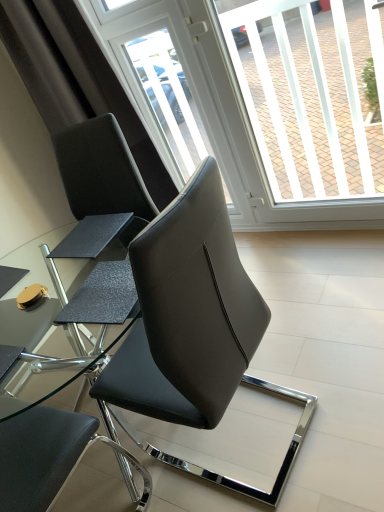
What do you see at coordinates (166, 87) in the screenshot? I see `transparent plastic screen door at upper center` at bounding box center [166, 87].

I want to click on transparent plastic screen door at upper center, so click(166, 87).

Is black leather chair at center, which is the 2th chair in front-to-back order, situated inside transparent glass window screen at upper center or outside?

black leather chair at center, which is the 2th chair in front-to-back order, is not inside transparent glass window screen at upper center, it's outside.

Could you measure the distance between black leather chair at center, the 2th chair in the back-to-front sequence, and transparent glass window screen at upper center?

black leather chair at center, the 2th chair in the back-to-front sequence, is 1.87 meters from transparent glass window screen at upper center.

Which object is further away from the camera taking this photo, black leather chair at center, the 2th chair in the back-to-front sequence, or transparent glass window screen at upper center?

transparent glass window screen at upper center is further from the camera.

From a real-world perspective, is black leather chair at center, which is the 2th chair in front-to-back order, positioned under transparent glass window screen at upper center based on gravity?

Yes, from a real-world perspective, black leather chair at center, which is the 2th chair in front-to-back order, is below transparent glass window screen at upper center.

Does transparent plastic screen door at upper center have a lesser height compared to black leather chair at center, which is the 1th chair from front to back?

No.

Considering the relative sizes of transparent plastic screen door at upper center and black leather chair at center, which is the 1th chair from front to back, in the image provided, is transparent plastic screen door at upper center thinner than black leather chair at center, which is the 1th chair from front to back,?

Indeed, transparent plastic screen door at upper center has a lesser width compared to black leather chair at center, which is the 1th chair from front to back.

Is transparent plastic screen door at upper center far away from black leather chair at center, which is the 1th chair from front to back?

Absolutely, transparent plastic screen door at upper center is distant from black leather chair at center, which is the 1th chair from front to back.

Image resolution: width=384 pixels, height=512 pixels. I want to click on screen door behind the black leather chair at center, which is the third chair in back-to-front order, so click(166, 87).

Is black leather chair at center, the 2th chair in the back-to-front sequence, far away from matte black chair at center, marked as the third chair in a front-to-back arrangement?

No, black leather chair at center, the 2th chair in the back-to-front sequence, is in close proximity to matte black chair at center, marked as the third chair in a front-to-back arrangement.

What's the angular difference between black leather chair at center, the 2th chair in the back-to-front sequence, and matte black chair at center, marked as the third chair in a front-to-back arrangement,'s facing directions?

black leather chair at center, the 2th chair in the back-to-front sequence, and matte black chair at center, marked as the third chair in a front-to-back arrangement, are facing 176 degrees away from each other.

In terms of height, does black leather chair at center, the 2th chair in the back-to-front sequence, look taller or shorter compared to matte black chair at center, marked as the third chair in a front-to-back arrangement?

black leather chair at center, the 2th chair in the back-to-front sequence, is shorter than matte black chair at center, marked as the third chair in a front-to-back arrangement.

Is black leather chair at center, the 2th chair in the back-to-front sequence, situated inside matte black chair at center, the 1th chair positioned from the back, or outside?

black leather chair at center, the 2th chair in the back-to-front sequence, exists outside the volume of matte black chair at center, the 1th chair positioned from the back.

Can you confirm if transparent plastic screen door at upper center is bigger than matte black chair at center, marked as the third chair in a front-to-back arrangement?

Actually, transparent plastic screen door at upper center might be smaller than matte black chair at center, marked as the third chair in a front-to-back arrangement.

Choose the correct answer: Is transparent plastic screen door at upper center inside matte black chair at center, marked as the third chair in a front-to-back arrangement, or outside it?

transparent plastic screen door at upper center is spatially situated outside matte black chair at center, marked as the third chair in a front-to-back arrangement.

Between transparent plastic screen door at upper center and matte black chair at center, marked as the third chair in a front-to-back arrangement, which one has more height?

transparent plastic screen door at upper center.

Considering the points (148, 67) and (113, 198), which point is in front, point (148, 67) or point (113, 198)?

Point (113, 198)

Is transparent glass window screen at upper center wider than black leather chair at center, which is the third chair in back-to-front order?

In fact, transparent glass window screen at upper center might be narrower than black leather chair at center, which is the third chair in back-to-front order.

From a real-world perspective, is transparent glass window screen at upper center on black leather chair at center, which is the 1th chair from front to back?

Yes, from a real-world perspective, transparent glass window screen at upper center is on top of black leather chair at center, which is the 1th chair from front to back.

Can we say transparent glass window screen at upper center lies outside black leather chair at center, which is the third chair in back-to-front order?

Absolutely, transparent glass window screen at upper center is external to black leather chair at center, which is the third chair in back-to-front order.

Are black leather chair at center, which is the 2th chair in front-to-back order, and transparent plastic screen door at upper center making contact?

No, black leather chair at center, which is the 2th chair in front-to-back order, is not in contact with transparent plastic screen door at upper center.

Is point (34, 460) positioned after point (164, 128)?

No, (34, 460) is closer to viewer.

From a real-world perspective, which object stands above the other?

In real-world perspective, transparent plastic screen door at upper center is above.

From the image's perspective, is black leather chair at center, which is the 2th chair in front-to-back order, above or below transparent plastic screen door at upper center?

Based on their image positions, black leather chair at center, which is the 2th chair in front-to-back order, is located beneath transparent plastic screen door at upper center.

From the picture: What's the angular difference between transparent plastic screen door at upper center and transparent glass window screen at upper center's facing directions?

The angular difference between transparent plastic screen door at upper center and transparent glass window screen at upper center is 0.0112 degrees.

Looking at their sizes, would you say transparent plastic screen door at upper center is wider or thinner than transparent glass window screen at upper center?

Clearly, transparent plastic screen door at upper center has less width compared to transparent glass window screen at upper center.

Are transparent plastic screen door at upper center and transparent glass window screen at upper center far apart?

No.

Is point (132, 60) farther from camera compared to point (341, 55)?

Yes.

Identify the location of window screen on the right of black leather chair at center, which is the 2th chair in front-to-back order. The image size is (384, 512). (309, 94).

Locate an element on the screen. The image size is (384, 512). the 2nd chair below the transparent plastic screen door at upper center (from the image's perspective) is located at coordinates (193, 329).

In the scene shown: Estimate the real-world distances between objects in this image. Which object is closer to transparent glass window screen at upper center, black leather chair at center, which is the 2th chair in front-to-back order, or transparent plastic screen door at upper center?

transparent plastic screen door at upper center is positioned closer to the anchor transparent glass window screen at upper center.

Which object lies further to the anchor point black leather chair at center, which is the 2th chair in front-to-back order, black leather chair at center, which is the third chair in back-to-front order, or transparent plastic screen door at upper center?

transparent plastic screen door at upper center is further to black leather chair at center, which is the 2th chair in front-to-back order.

Based on their spatial positions, is transparent glass window screen at upper center or black leather chair at center, which is the 1th chair from front to back, further from transparent plastic screen door at upper center?

black leather chair at center, which is the 1th chair from front to back, is further to transparent plastic screen door at upper center.

Looking at the image, which one is located closer to black leather chair at center, which is the 1th chair from front to back, black leather chair at center, which is the 2th chair in front-to-back order, or matte black chair at center, marked as the third chair in a front-to-back arrangement?

Based on the image, black leather chair at center, which is the 2th chair in front-to-back order, appears to be nearer to black leather chair at center, which is the 1th chair from front to back.

Estimate the real-world distances between objects in this image. Which object is further from matte black chair at center, marked as the third chair in a front-to-back arrangement, transparent plastic screen door at upper center or transparent glass window screen at upper center?

transparent glass window screen at upper center.

Consider the image. Looking at the image, which one is located closer to transparent glass window screen at upper center, black leather chair at center, which is the third chair in back-to-front order, or matte black chair at center, the 1th chair positioned from the back?

matte black chair at center, the 1th chair positioned from the back, lies closer to transparent glass window screen at upper center than the other object.

Considering their positions, is matte black chair at center, the 1th chair positioned from the back, positioned closer to transparent plastic screen door at upper center than black leather chair at center, which is the 2th chair in front-to-back order?

matte black chair at center, the 1th chair positioned from the back, lies closer to transparent plastic screen door at upper center than the other object.

Estimate the real-world distances between objects in this image. Which object is closer to black leather chair at center, which is the 1th chair from front to back, matte black chair at center, marked as the third chair in a front-to-back arrangement, or transparent plastic screen door at upper center?

Among the two, matte black chair at center, marked as the third chair in a front-to-back arrangement, is located nearer to black leather chair at center, which is the 1th chair from front to back.

At what (x,y) coordinates should I click in order to perform the action: click on chair that lies between matte black chair at center, the 1th chair positioned from the back, and black leather chair at center, which is the 2th chair in front-to-back order, from top to bottom. Please return your answer as a coordinate pair (x, y). The height and width of the screenshot is (512, 384). Looking at the image, I should click on point(193,329).

Locate an element on the screen. The image size is (384, 512). window screen between black leather chair at center, which is the 1th chair from front to back, and transparent plastic screen door at upper center in the front-back direction is located at coordinates (309, 94).

The image size is (384, 512). I want to click on screen door between matte black chair at center, marked as the third chair in a front-to-back arrangement, and transparent glass window screen at upper center, in the horizontal direction, so click(x=166, y=87).

This screenshot has width=384, height=512. Identify the location of window screen between transparent plastic screen door at upper center and black leather chair at center, the 2th chair in the back-to-front sequence, from top to bottom. (309, 94).